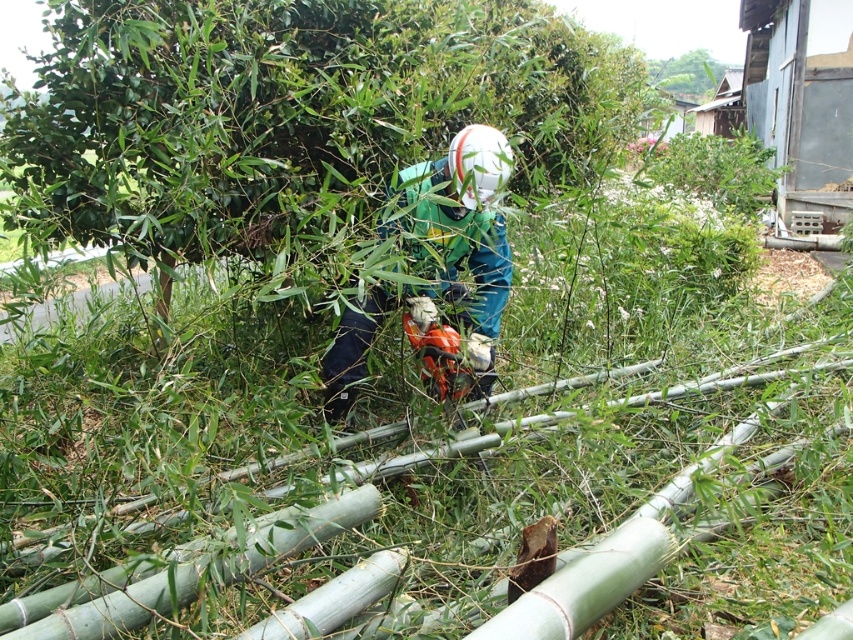
Question: Which point is farther to the camera?

Choices:
 (A) (109, 189)
 (B) (445, 260)

Answer: (B)

Question: Can you confirm if green bamboo at center is positioned below green matte jacket at center?

Choices:
 (A) no
 (B) yes

Answer: (A)

Question: Among these points, which one is farthest from the camera?

Choices:
 (A) (146, 13)
 (B) (676, 90)
 (C) (495, 186)

Answer: (B)

Question: Among these objects, which one is nearest to the camera?

Choices:
 (A) green bamboo at center
 (B) green matte jacket at center

Answer: (B)

Question: Where is green matte jacket at center located in relation to green bamboo at upper center in the image?

Choices:
 (A) left
 (B) right

Answer: (A)

Question: Observing the image, what is the correct spatial positioning of green bamboo at center in reference to green bamboo at upper center?

Choices:
 (A) left
 (B) right

Answer: (A)